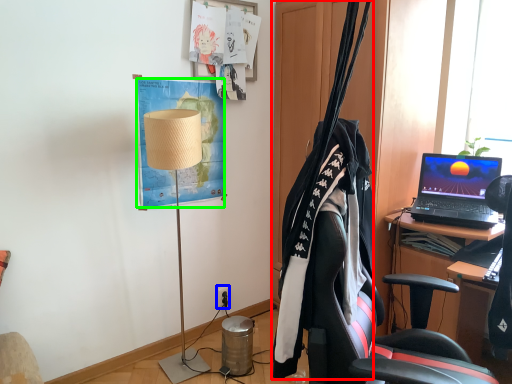
Question: Considering the real-world distances, which object is closest to clothesline (highlighted by a red box)? power outlet (highlighted by a blue box) or poster (highlighted by a green box).

Choices:
 (A) power outlet
 (B) poster

Answer: (B)